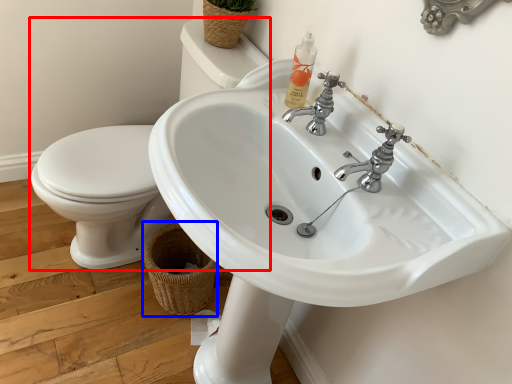
Question: Among these objects, which one is nearest to the camera, sink (highlighted by a red box) or basket (highlighted by a blue box)?

Choices:
 (A) sink
 (B) basket

Answer: (A)